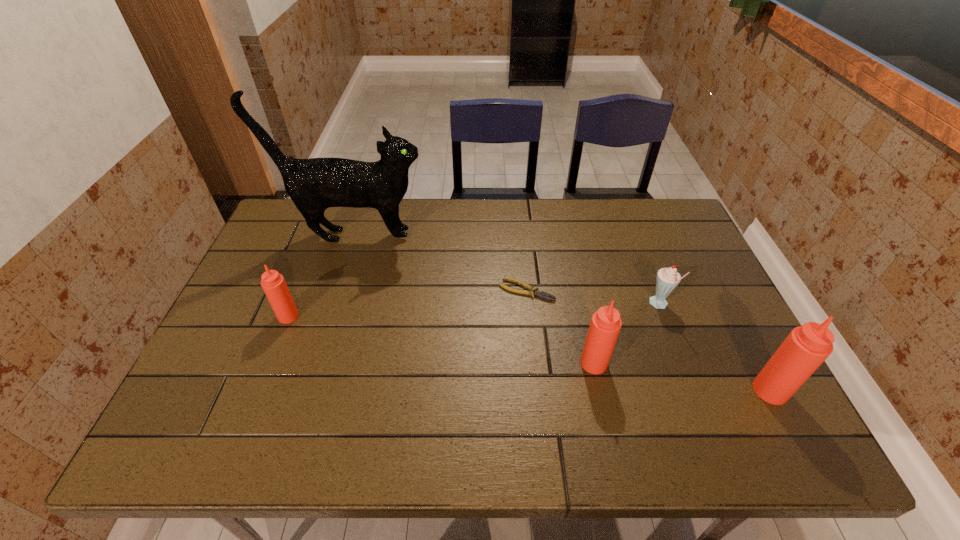
This screenshot has height=540, width=960. Identify the location of the shortest Tabasco sauce. (274, 285).

This screenshot has width=960, height=540. I want to click on the farthest Tabasco sauce, so click(274, 285).

Locate an element on the screen. This screenshot has width=960, height=540. the second nearest Tabasco sauce is located at coordinates (605, 325).

This screenshot has width=960, height=540. What are the coordinates of `the fourth shortest object` in the screenshot? It's located at (605, 325).

Locate an element on the screen. the rightmost Tabasco sauce is located at coordinates (806, 347).

Locate an element on the screen. The height and width of the screenshot is (540, 960). the rightmost object is located at coordinates (806, 347).

At what (x,y) coordinates should I click in order to perform the action: click on the second object from right to left. Please return your answer as a coordinate pair (x, y). The height and width of the screenshot is (540, 960). Looking at the image, I should click on (667, 279).

Identify the location of milkshake. Image resolution: width=960 pixels, height=540 pixels. (667, 279).

Image resolution: width=960 pixels, height=540 pixels. Identify the location of the fourth object from right to left. [531, 291].

Find the location of a particular element. the shortest object is located at coordinates (531, 291).